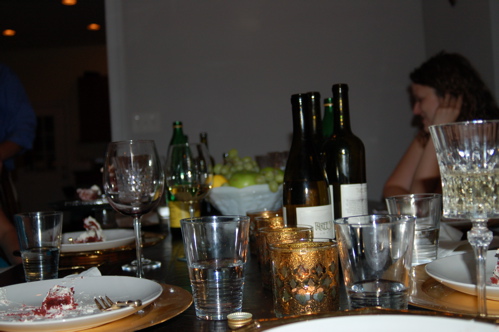
You are a GUI agent. You are given a task and a screenshot of the screen. Output one action in this format:
    pyautogui.click(x=<x>, y=<y>)
    Task: Click on the white plate
    This screenshot has width=499, height=332.
    Given the screenshot: What is the action you would take?
    pyautogui.click(x=115, y=283), pyautogui.click(x=116, y=233), pyautogui.click(x=449, y=269)